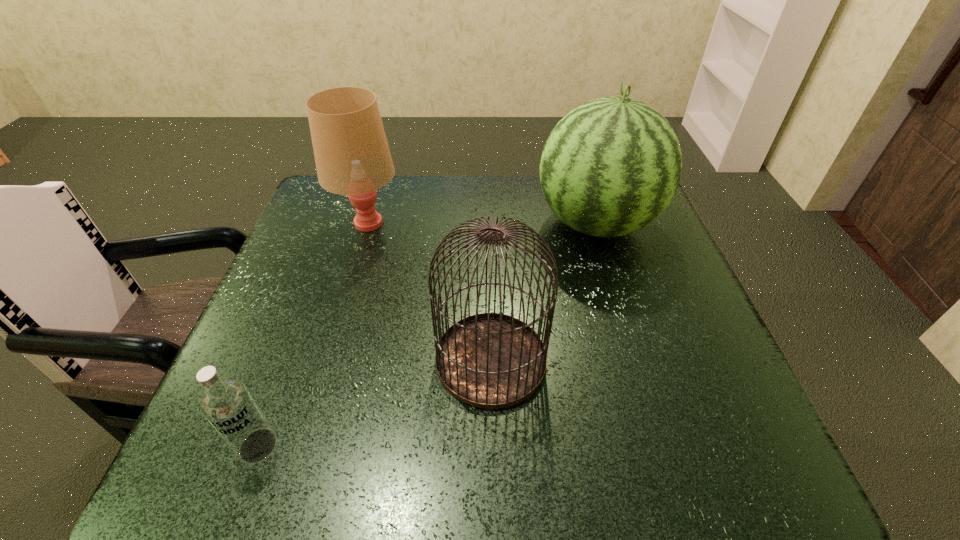
In order to click on free spot at the left edge of the desktop in this screenshot , I will do `click(336, 229)`.

This screenshot has height=540, width=960. What are the coordinates of `vacant region at the right edge of the desktop` in the screenshot? It's located at (657, 239).

This screenshot has width=960, height=540. Identify the location of vacant area at the near left corner of the desktop. (185, 465).

In the image, there is a desktop. At what (x,y) coordinates should I click in order to perform the action: click on vacant space at the near right corner. Please return your answer as a coordinate pair (x, y). Looking at the image, I should click on (708, 484).

The height and width of the screenshot is (540, 960). Identify the location of free space between the vodka and the rightmost object. (427, 335).

The width and height of the screenshot is (960, 540). In order to click on vacant area between the third object from left to right and the shortest object in this screenshot , I will do `click(374, 403)`.

The width and height of the screenshot is (960, 540). Identify the location of free space between the birdcage and the shortest object. (374, 403).

Where is `vacant area between the shortest object and the rightmost object`? The width and height of the screenshot is (960, 540). vacant area between the shortest object and the rightmost object is located at coordinates (427, 335).

At what (x,y) coordinates should I click in order to perform the action: click on vacant space that's between the birdcage and the shortest object. Please return your answer as a coordinate pair (x, y). Looking at the image, I should click on [x=374, y=403].

Find the location of a particular element. Image resolution: width=960 pixels, height=540 pixels. free space between the lampshade and the nearest object is located at coordinates (313, 335).